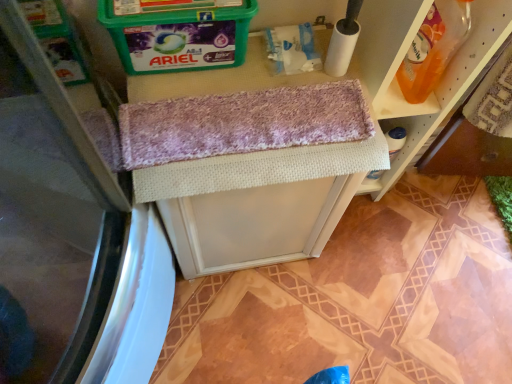
The image size is (512, 384). I want to click on free space in front of woven fabric vanity at center, so 256,324.